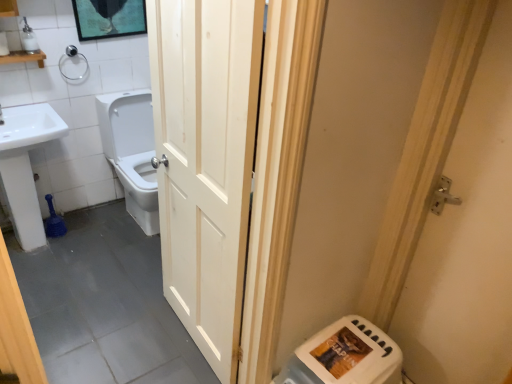
Identify the location of free space that is in between white ceramic sink at left and white wood door at center, the first door when ordered from left to right. (119, 296).